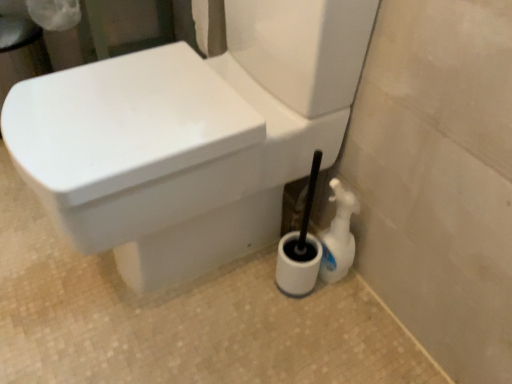
This screenshot has width=512, height=384. In order to click on unoccupied area in front of white plastic spray bottle at lower right in this screenshot , I will do `click(336, 331)`.